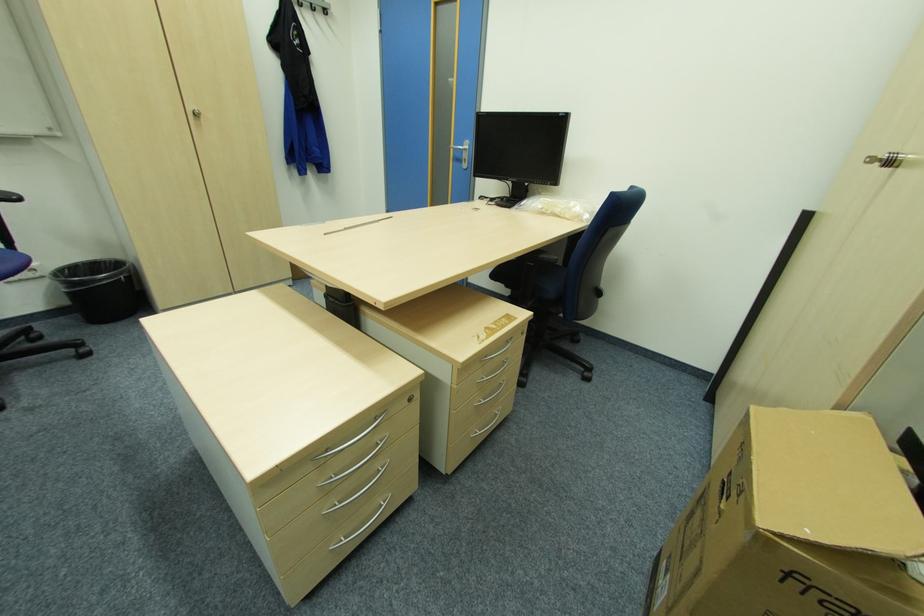
What do you see at coordinates (532, 278) in the screenshot? I see `the blue chair sitting surface` at bounding box center [532, 278].